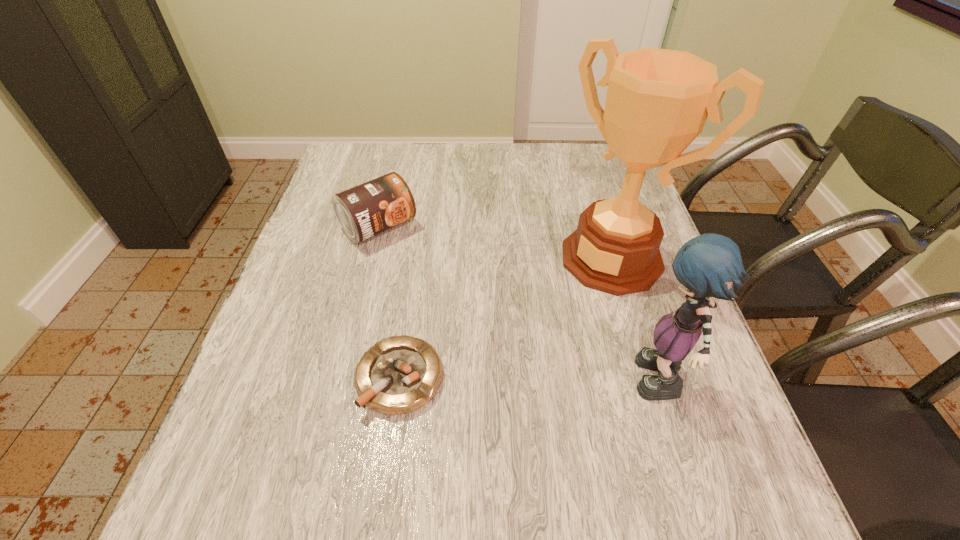
Where is `vacant space at the far edge of the desktop`? vacant space at the far edge of the desktop is located at coordinates (538, 154).

Locate an element on the screen. Image resolution: width=960 pixels, height=540 pixels. vacant space at the near edge is located at coordinates (494, 427).

This screenshot has height=540, width=960. In the image, there is a desktop. In order to click on free space at the right edge in this screenshot , I will do `click(589, 199)`.

Identify the location of vacant space at the near left corner of the desktop. (299, 413).

This screenshot has width=960, height=540. What are the coordinates of `free space at the far right corner of the desktop` in the screenshot? It's located at (602, 167).

Image resolution: width=960 pixels, height=540 pixels. What are the coordinates of `free point at the near right corner` in the screenshot? It's located at (672, 439).

Locate an element on the screen. The height and width of the screenshot is (540, 960). free spot between the award and the shortest object is located at coordinates (506, 318).

Locate an element on the screen. The image size is (960, 540). vacant region between the second shortest object and the third shortest object is located at coordinates (519, 307).

Find the location of a particular element. This screenshot has width=960, height=540. empty location between the can and the ashtray is located at coordinates point(389,302).

Where is `empty location between the award and the can`? The width and height of the screenshot is (960, 540). empty location between the award and the can is located at coordinates (495, 242).